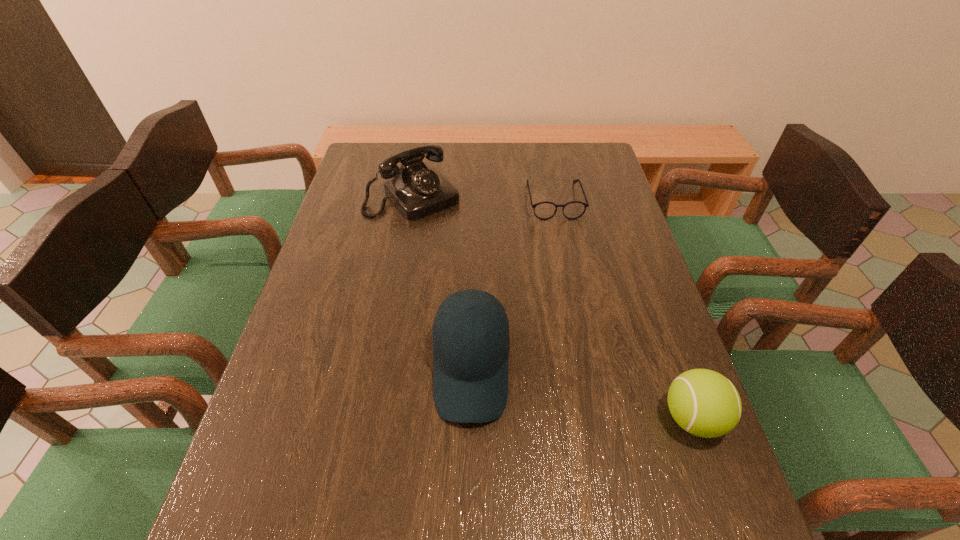
Find the location of `unoccupied area between the baseball cap and the spectacles`. unoccupied area between the baseball cap and the spectacles is located at coordinates (513, 285).

Find the location of a particular element. The height and width of the screenshot is (540, 960). blank region between the telephone and the baseball cap is located at coordinates (442, 282).

You are a GUI agent. You are given a task and a screenshot of the screen. Output one action in this format:
    pyautogui.click(x=<x>, y=<y>)
    Task: Click on the blank region between the rightmost object and the baseball cap
    
    Given the screenshot: What is the action you would take?
    pyautogui.click(x=582, y=393)

The width and height of the screenshot is (960, 540). Find the location of `vacant space that's between the spectacles and the telephone`. vacant space that's between the spectacles and the telephone is located at coordinates (484, 199).

This screenshot has height=540, width=960. Identify the location of empty space that is in between the shortest object and the telephone. (484, 199).

You are a GUI agent. You are given a task and a screenshot of the screen. Output one action in this format:
    pyautogui.click(x=<x>, y=<y>)
    Task: Click on the free space between the second shortest object and the shortest object
    The image size is (960, 540).
    Given the screenshot: What is the action you would take?
    pyautogui.click(x=623, y=309)

At what (x,y) coordinates should I click in order to perform the action: click on vacant area that lies between the rightmost object and the baseball cap. Please return your answer as a coordinate pair (x, y). The height and width of the screenshot is (540, 960). Looking at the image, I should click on (582, 393).

What are the coordinates of `free space between the baseball cap and the telephone` in the screenshot? It's located at (442, 282).

Where is `object that is the second closest to the baseball cap`? object that is the second closest to the baseball cap is located at coordinates (417, 190).

Identify the location of object that is the third closest to the second object from right to left. (705, 403).